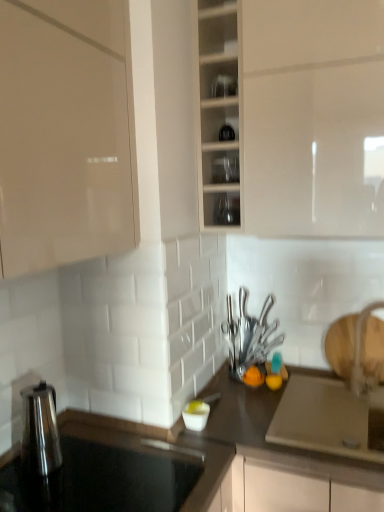
You are a GUI agent. You are given a task and a screenshot of the screen. Output one action in this format:
    pyautogui.click(x=<x>, y=<y>)
    Task: Click on the spots to the right of polished silver knife set at center, the 2th tableware from the bottom
    Image resolution: width=384 pixels, height=512 pixels.
    Given the screenshot: What is the action you would take?
    pyautogui.click(x=305, y=374)